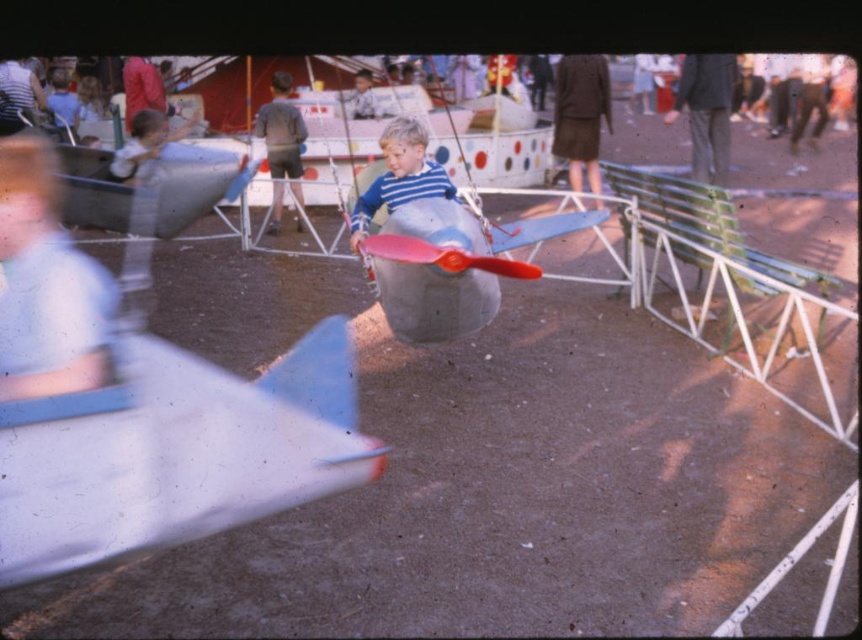
Between point (400, 164) and point (420, 140), which one is positioned behind?

Point (400, 164)

Does point (409, 156) come farther from viewer compared to point (355, 237)?

Yes, point (409, 156) is behind point (355, 237).

Locate an element on the screen. The height and width of the screenshot is (640, 862). metallic silver airplane at center is located at coordinates (438, 243).